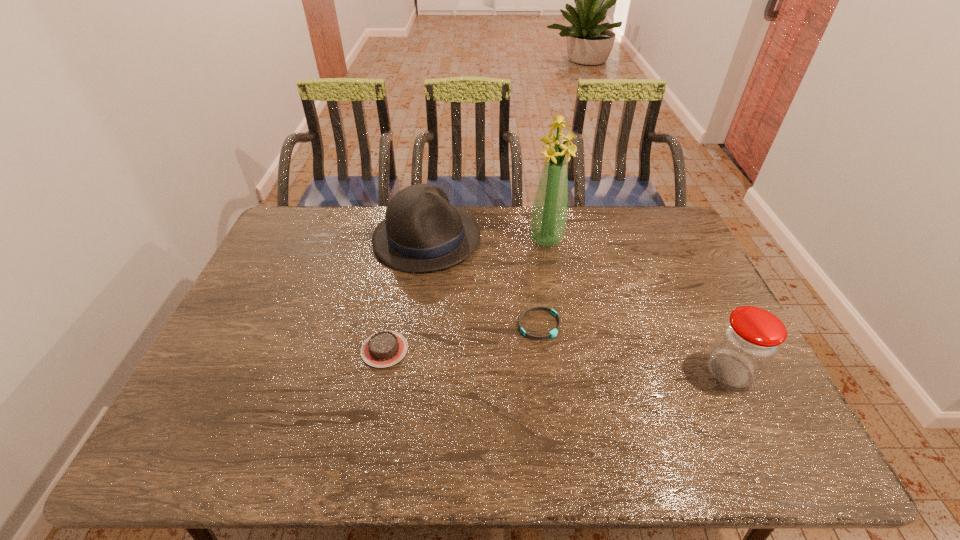
You are a GUI agent. You are given a task and a screenshot of the screen. Output one action in this format:
    pyautogui.click(x=<x>, y=<y>)
    Task: Click on the fourth tallest object
    This screenshot has width=960, height=540.
    Given the screenshot: What is the action you would take?
    pyautogui.click(x=385, y=348)

The height and width of the screenshot is (540, 960). Find the location of `jar`. jar is located at coordinates (749, 340).

This screenshot has width=960, height=540. In order to click on bowler hat in this screenshot , I will do (x=422, y=232).

What are the coordinates of `the shortest object` in the screenshot? It's located at (554, 332).

Where is `bouquet`? This screenshot has width=960, height=540. bouquet is located at coordinates click(x=548, y=221).

The image size is (960, 540). What are the coordinates of `vacant region located 0.130m on the back of the second shortest object` in the screenshot? It's located at (395, 299).

You are a GUI agent. You are given a task and a screenshot of the screen. Output one action in this format:
    pyautogui.click(x=<x>, y=<y>)
    Task: Click on the free space located 0.340m on the back of the jar
    
    Given the screenshot: What is the action you would take?
    pyautogui.click(x=678, y=267)

You are a GUI agent. You are given a task and a screenshot of the screen. Output one action in this format:
    pyautogui.click(x=<x>, y=<y>)
    Task: Click on the blank space located on the front-facing side of the bowler hat
    This screenshot has height=540, width=960.
    Given the screenshot: What is the action you would take?
    pyautogui.click(x=489, y=288)

I want to click on vacant area situated on the front-facing side of the bowler hat, so click(536, 325).

In order to click on vacant space located on the front-facing side of the bowler hat in this screenshot , I will do `click(507, 302)`.